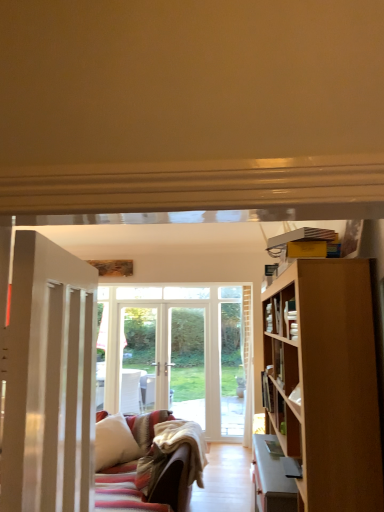
Question: Is white painted wood door at left outside white soft pillow at lower left?

Choices:
 (A) no
 (B) yes

Answer: (B)

Question: Can you confirm if white painted wood door at left is thinner than white soft pillow at lower left?

Choices:
 (A) yes
 (B) no

Answer: (A)

Question: Can you confirm if white painted wood door at left is positioned to the right of white soft pillow at lower left?

Choices:
 (A) no
 (B) yes

Answer: (B)

Question: From a real-world perspective, is white painted wood door at left below white soft pillow at lower left?

Choices:
 (A) no
 (B) yes

Answer: (A)

Question: From the image's perspective, is white painted wood door at left above white soft pillow at lower left?

Choices:
 (A) no
 (B) yes

Answer: (B)

Question: Would you say white soft pillow at lower left is part of white painted wood door at left's contents?

Choices:
 (A) yes
 (B) no

Answer: (B)

Question: Considering the relative sizes of hardcover book at right and wooden bookshelf at right in the image provided, is hardcover book at right thinner than wooden bookshelf at right?

Choices:
 (A) no
 (B) yes

Answer: (B)

Question: Can you confirm if hardcover book at right is bigger than wooden bookshelf at right?

Choices:
 (A) no
 (B) yes

Answer: (A)

Question: From the image's perspective, is hardcover book at right over wooden bookshelf at right?

Choices:
 (A) no
 (B) yes

Answer: (A)

Question: Is hardcover book at right outside wooden bookshelf at right?

Choices:
 (A) no
 (B) yes

Answer: (B)

Question: Would you say hardcover book at right contains wooden bookshelf at right?

Choices:
 (A) yes
 (B) no

Answer: (B)

Question: Is hardcover book at right looking in the opposite direction of wooden bookshelf at right?

Choices:
 (A) no
 (B) yes

Answer: (A)

Question: From the image's perspective, is wooden bookshelf at right under white painted wood door at left?

Choices:
 (A) no
 (B) yes

Answer: (A)